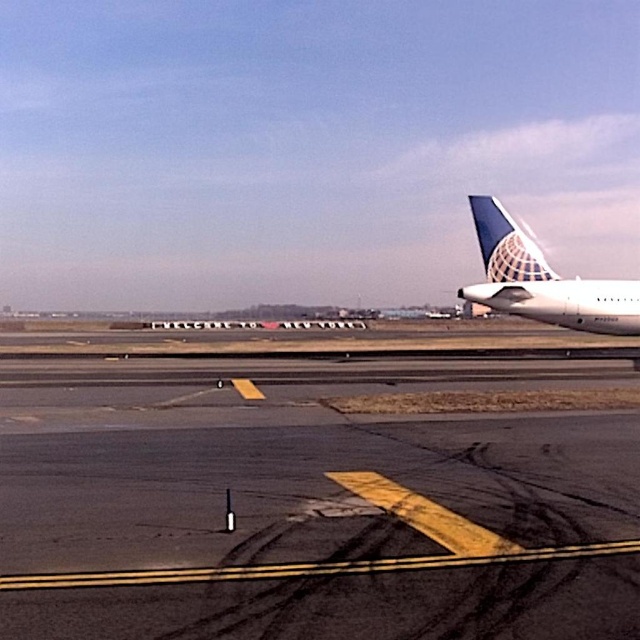
Question: Is black asphalt tarmac at center to the left of white glossy airplane at right from the viewer's perspective?

Choices:
 (A) yes
 (B) no

Answer: (A)

Question: Can you confirm if black asphalt tarmac at center is thinner than white glossy airplane at right?

Choices:
 (A) yes
 (B) no

Answer: (B)

Question: Which point is closer to the camera?

Choices:
 (A) (515, 257)
 (B) (324, 516)

Answer: (B)

Question: Among these points, which one is farthest from the camera?

Choices:
 (A) (580, 296)
 (B) (291, 596)
 (C) (528, 260)

Answer: (C)

Question: Does black asphalt tarmac at center lie behind white glossy airplane at right?

Choices:
 (A) no
 (B) yes

Answer: (A)

Question: Which point is farther from the camera taking this photo?

Choices:
 (A) (252, 470)
 (B) (516, 228)

Answer: (B)